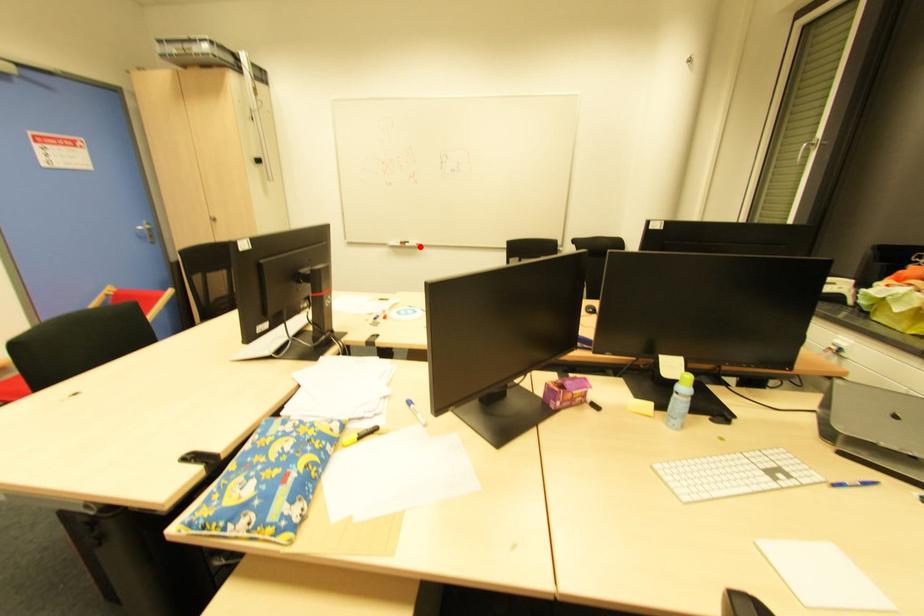
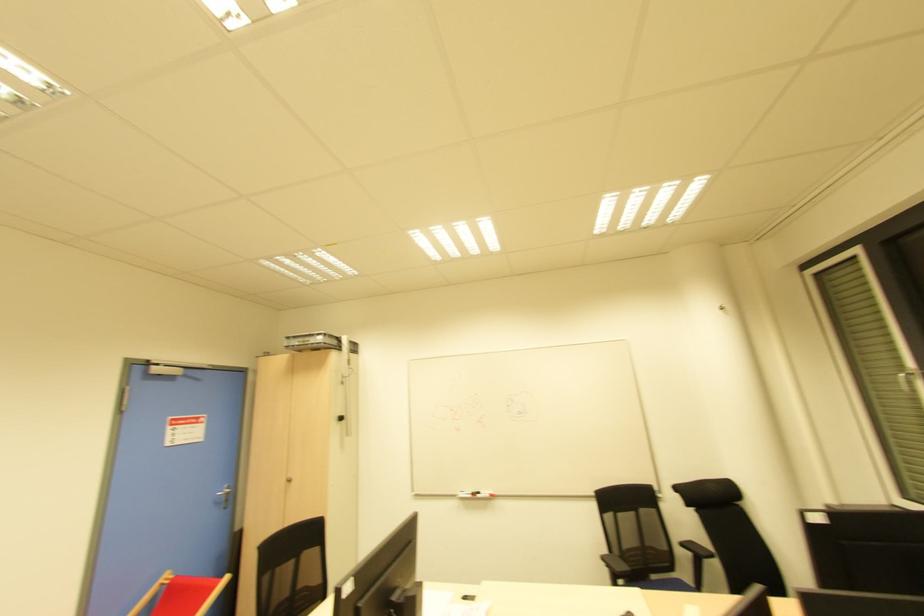
Where in the second image is the point corresponding to the highlighted location from the first image?

(492, 496)